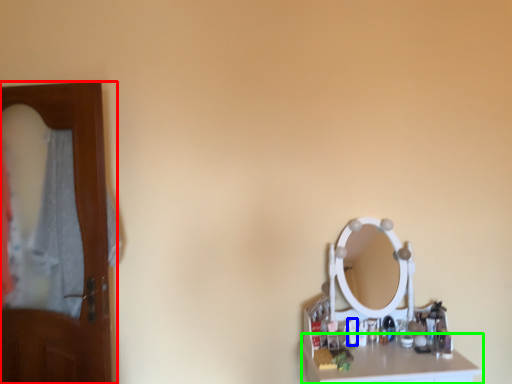
Question: Which is nearer to the door (highlighted by a red box)? toiletry (highlighted by a blue box) or counter top (highlighted by a green box).

Choices:
 (A) toiletry
 (B) counter top

Answer: (B)